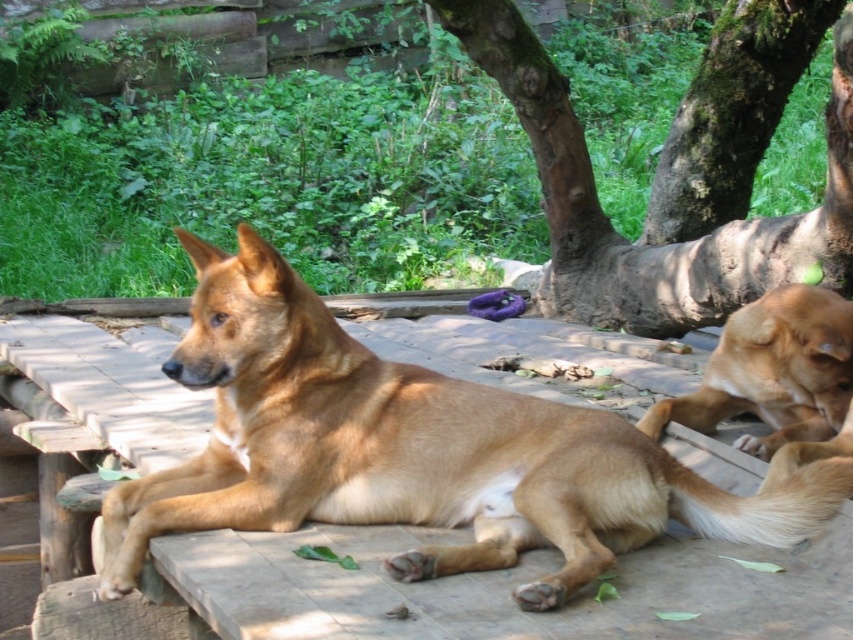
You are a photographer trying to capture a photo of the golden fur dog at center and the brown rough bark tree at upper center. Based on their positions, can you tell me if the tree is above or below the dog in the image?

The golden fur dog at center is below brown rough bark tree at upper center, so the tree is above the dog in the image.

You are a hiker who wants to take a photo of the golden fur dog at right without including the brown rough bark tree at upper center in the frame. Is this possible given their positions?

The brown rough bark tree at upper center is above the golden fur dog at right, so if you position yourself below the tree and aim downward towards the dog, you can exclude the tree from the photo.